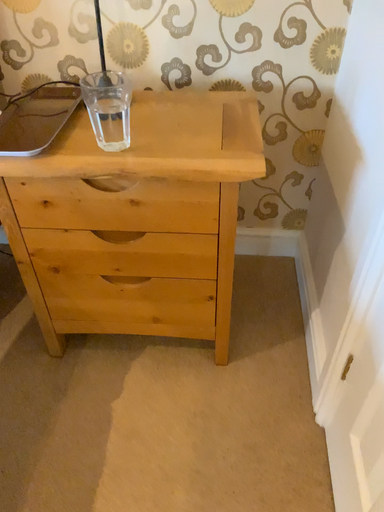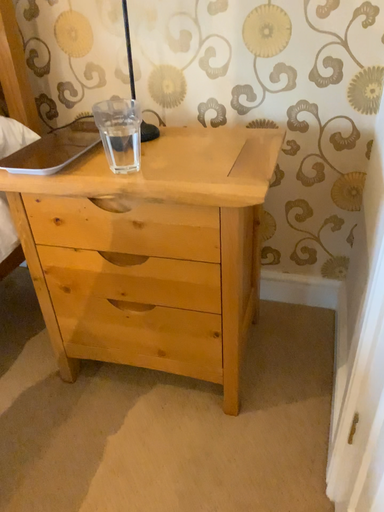
Question: Which way did the camera rotate in the video?

Choices:
 (A) rotated right
 (B) rotated left

Answer: (B)